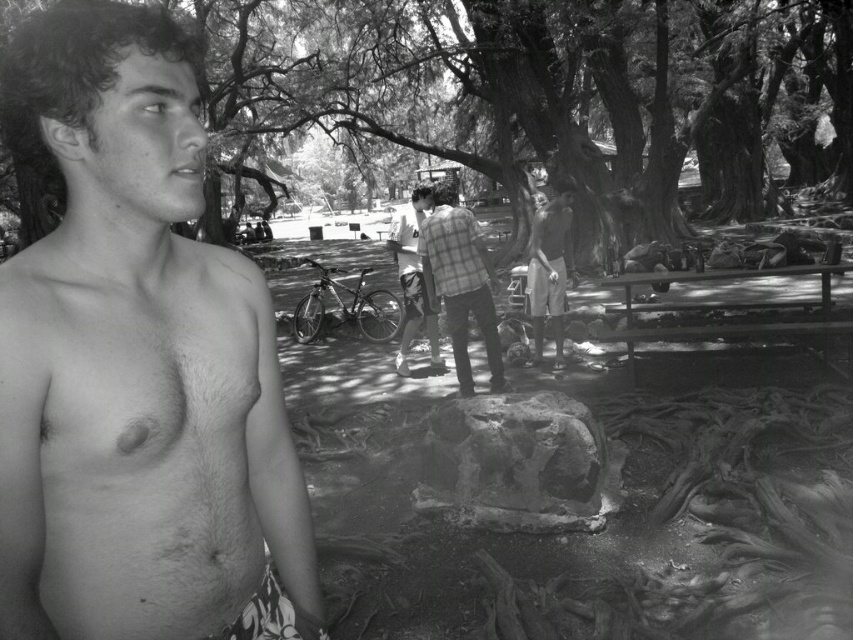
Is point (624, 196) closer to camera compared to point (451, 218)?

No, it is behind (451, 218).

Does rough bark tree at center appear on the right side of plaid fabric shirt at center?

Indeed, rough bark tree at center is positioned on the right side of plaid fabric shirt at center.

Between point (495, 72) and point (476, 228), which one is positioned in front?

Point (476, 228) is more forward.

Locate an element on the screen. The height and width of the screenshot is (640, 853). rough bark tree at center is located at coordinates (465, 92).

You are a GUI agent. You are given a task and a screenshot of the screen. Output one action in this format:
    pyautogui.click(x=<x>, y=<y>)
    Task: Click on the hairy skin at left
    
    Given the screenshot: What is the action you would take?
    pyautogui.click(x=136, y=362)

Who is taller, hairy skin at left or rough bark tree at center?

rough bark tree at center is taller.

Does point (143, 520) lie in front of point (323, 88)?

Yes.

Image resolution: width=853 pixels, height=640 pixels. I want to click on hairy skin at left, so click(x=136, y=362).

Can you confirm if hairy skin at left is positioned to the right of plaid fabric shirt at center?

In fact, hairy skin at left is to the left of plaid fabric shirt at center.

Identify the location of hairy skin at left. (136, 362).